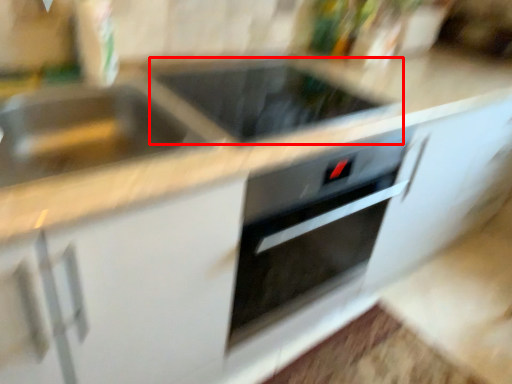
Question: Observing the image, what is the correct spatial positioning of appliance (annotated by the red box) in reference to sink?

Choices:
 (A) left
 (B) right

Answer: (B)